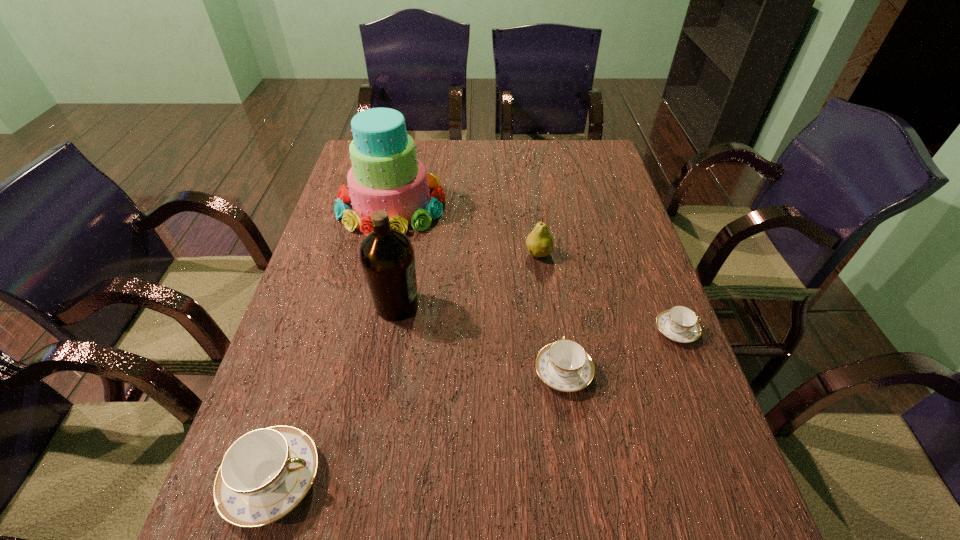
I want to click on vacant area that lies between the rightmost teacup and the fourth shortest object, so click(608, 292).

At what (x,y) coordinates should I click in order to perform the action: click on vacant area between the fourth shortest object and the olive oil. Please return your answer as a coordinate pair (x, y). Looking at the image, I should click on (468, 279).

At what (x,y) coordinates should I click in order to perform the action: click on free area in between the olive oil and the pear. Please return your answer as a coordinate pair (x, y). This screenshot has height=540, width=960. Looking at the image, I should click on (468, 279).

You are a GUI agent. You are given a task and a screenshot of the screen. Output one action in this format:
    pyautogui.click(x=<x>, y=<y>)
    Task: Click on the free space between the olive oil and the second shortest teacup
    Image resolution: width=960 pixels, height=540 pixels.
    Given the screenshot: What is the action you would take?
    pyautogui.click(x=480, y=339)

Image resolution: width=960 pixels, height=540 pixels. Identify the location of vacant space in between the fourth shortest object and the olive oil. (468, 279).

You are a GUI agent. You are given a task and a screenshot of the screen. Output one action in this format:
    pyautogui.click(x=<x>, y=<y>)
    Task: Click on the free space between the shortest teacup and the olive oil
    The image size is (960, 540).
    Given the screenshot: What is the action you would take?
    pos(537,318)

Find the location of a particular element. The height and width of the screenshot is (540, 960). vacant area that lies between the second teacup from right to left and the rightmost teacup is located at coordinates (620, 351).

At what (x,y) coordinates should I click in order to perform the action: click on the third closest object relative to the farthest object. Please return your answer as a coordinate pair (x, y). The width and height of the screenshot is (960, 540). Looking at the image, I should click on (565, 366).

Identify which object is located as the second nearest to the shortest teacup. Please provide its 2D coordinates. Your answer should be formatted as a tuple, i.e. [(x, y)], where the tuple contains the x and y coordinates of a point satisfying the conditions above.

[(539, 242)]

Select which teacup appears as the third closest to the farthest object. Please provide its 2D coordinates. Your answer should be formatted as a tuple, i.e. [(x, y)], where the tuple contains the x and y coordinates of a point satisfying the conditions above.

[(680, 324)]